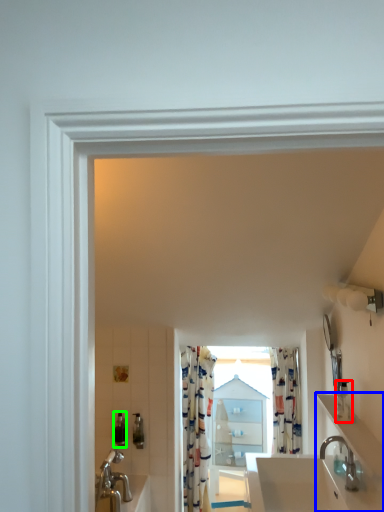
Question: Estimate the real-world distances between objects in this image. Which object is closer to toiletry (highlighted by a red box), counter top (highlighted by a blue box) or toiletry (highlighted by a green box)?

Choices:
 (A) counter top
 (B) toiletry

Answer: (A)